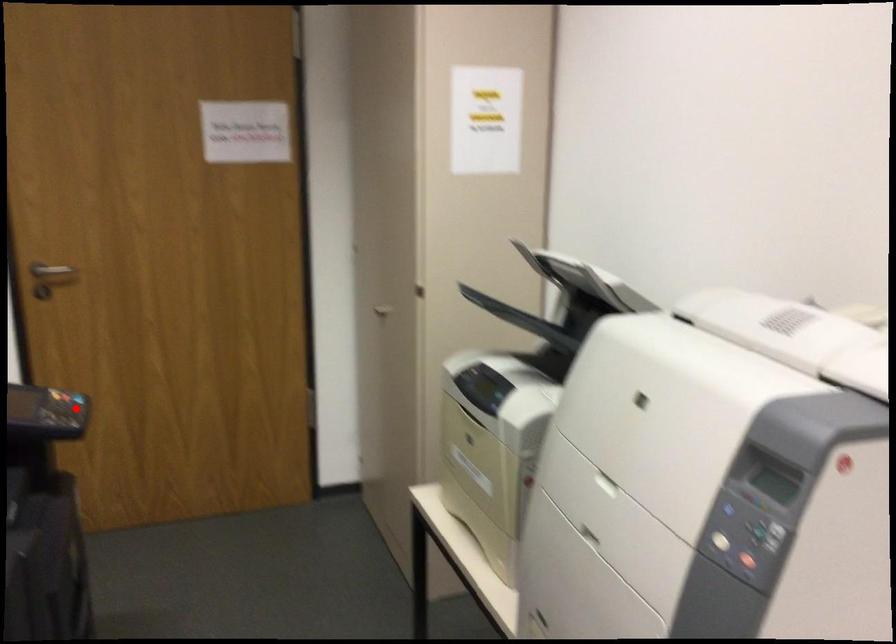
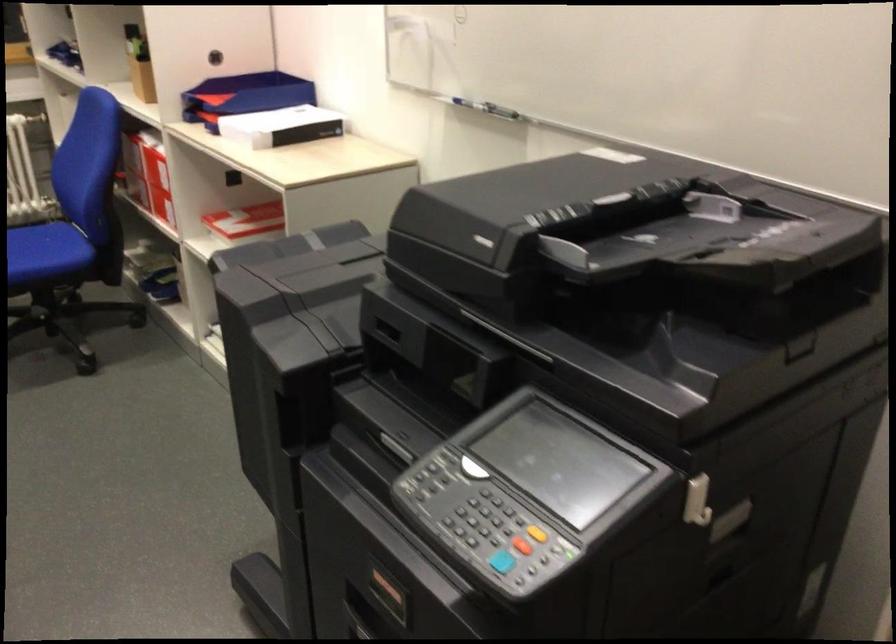
Question: A red point is marked in image1. In image2, is the corresponding 3D point closer to the camera or farther? Reply with the corresponding letter.

Choices:
 (A) The corresponding 3D point is closer.
 (B) The corresponding 3D point is farther.

Answer: (A)